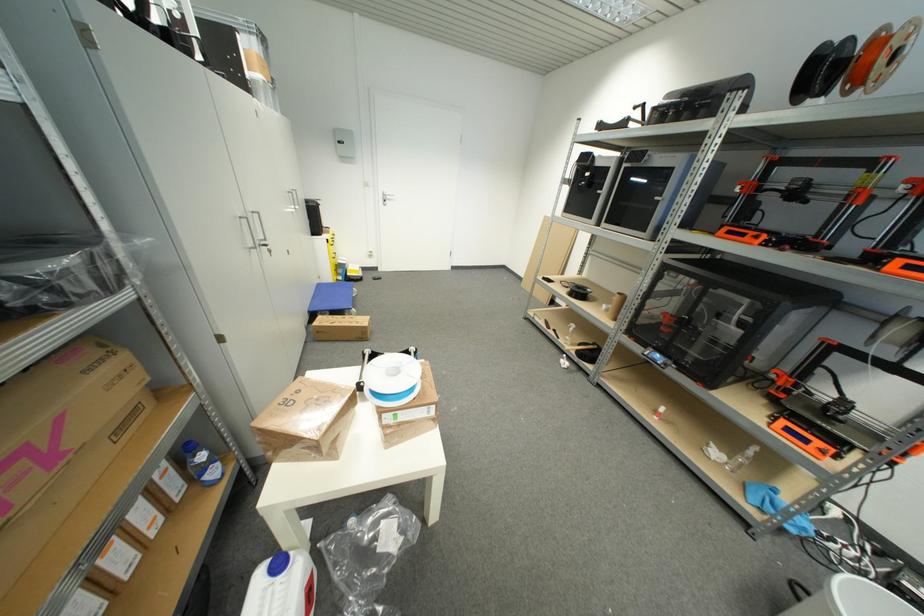
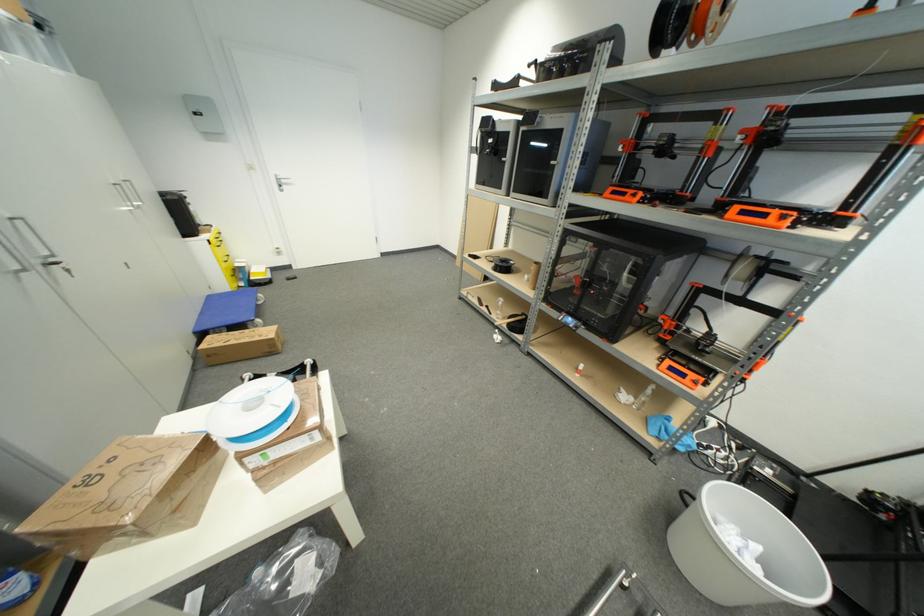
Locate, in the second image, the point that corresponds to pixel 586 294 in the first image.

(508, 267)